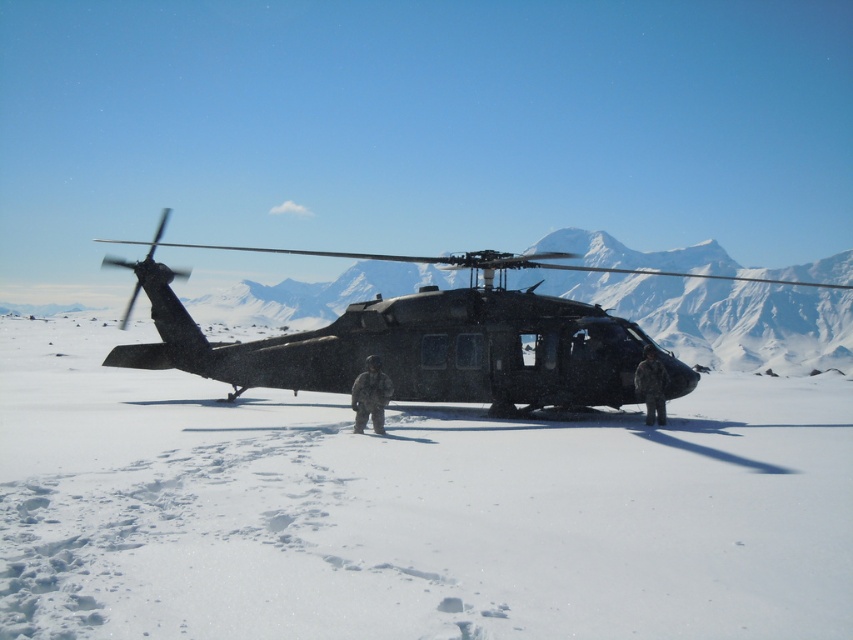
Does matte black helicopter at center have a lesser width compared to camouflage uniform at center?

Incorrect, matte black helicopter at center's width is not less than camouflage uniform at center's.

Between point (494, 374) and point (364, 422), which one is positioned behind?

The point (494, 374) is behind.

This screenshot has width=853, height=640. Find the location of `matte black helicopter at center`. matte black helicopter at center is located at coordinates (424, 339).

The width and height of the screenshot is (853, 640). What do you see at coordinates (409, 508) in the screenshot? I see `white powdery snow at center` at bounding box center [409, 508].

Is the position of white powdery snow at center less distant than that of camouflage fabric uniform at right?

Yes, white powdery snow at center is closer to the viewer.

Which is in front, point (97, 406) or point (653, 401)?

Point (653, 401) is more forward.

Identify the location of white powdery snow at center. (409, 508).

Does matte black helicopter at center appear over camouflage fabric uniform at right?

Yes.

Between point (294, 252) and point (648, 374), which one is positioned in front?

Positioned in front is point (648, 374).

Identify the location of matte black helicopter at center. The image size is (853, 640). (424, 339).